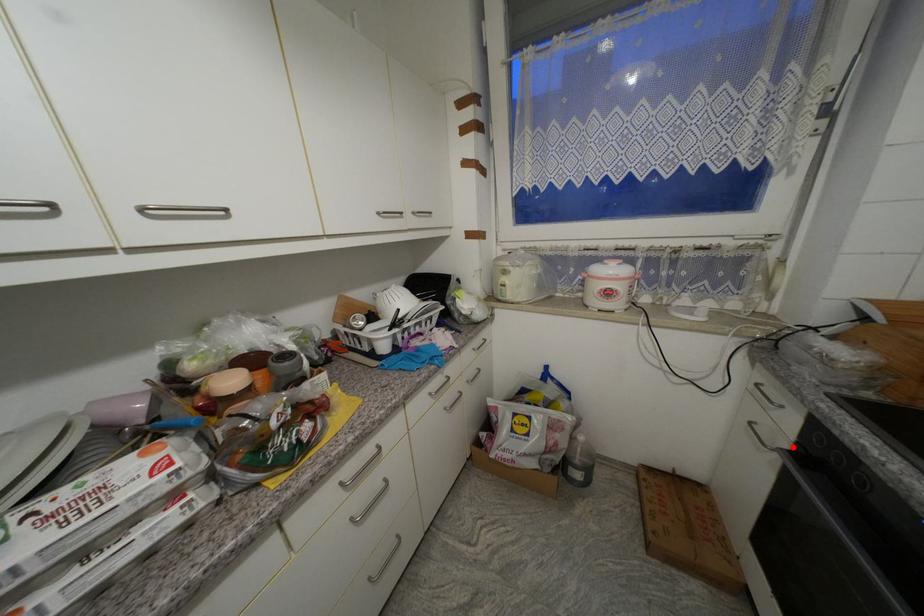
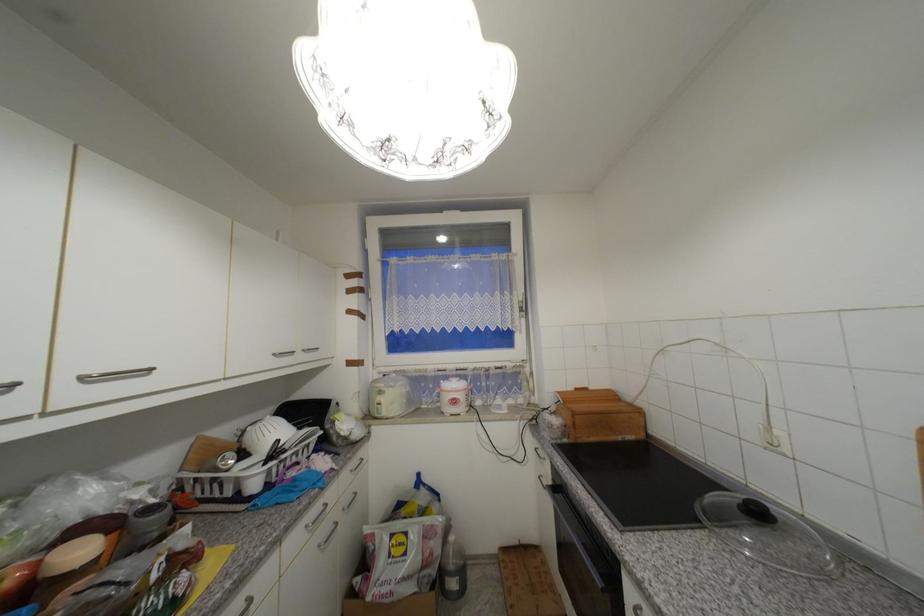
Question: I am providing you with two images of the same scene from different viewpoints. Image1 has a red point marked. In image2, the corresponding 3D location appears at what relative position? Reply with the corresponding letter.

Choices:
 (A) Closer
 (B) Farther

Answer: (B)